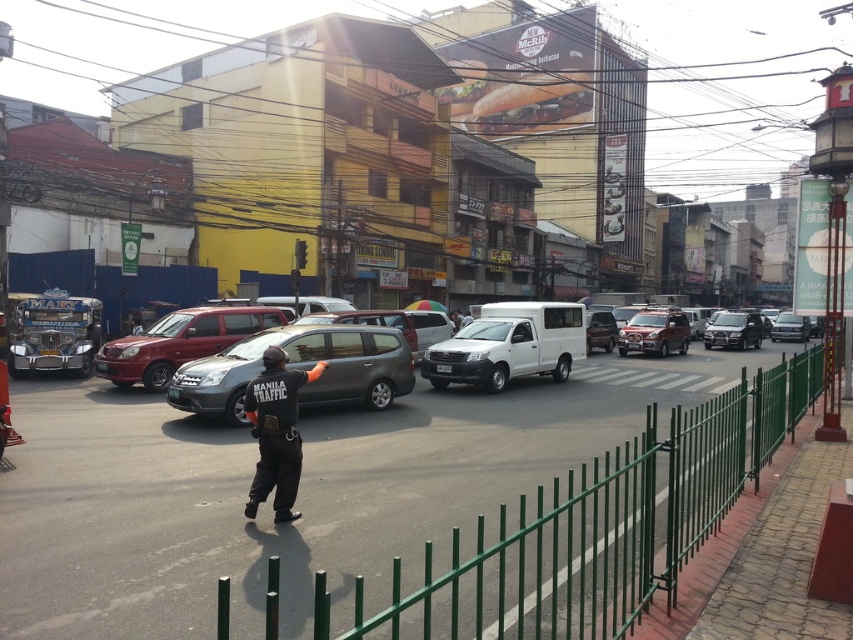
You are a pedestrian standing at the sidewalk and want to cross the street. You see a white matte van at center and a matte red suv at center. Which vehicle is closer to the right side of the road?

The white matte van at center is closer to the right side of the road because it is positioned to the right of the matte red suv at center.

You are a pedestrian trying to cross the street. You see the matte red suv at center and the shiny silver sedan at center. Which vehicle might block your view of oncoming traffic due to its height?

The matte red suv at center is much taller than the shiny silver sedan at center, so it might block your view of oncoming traffic more effectively.